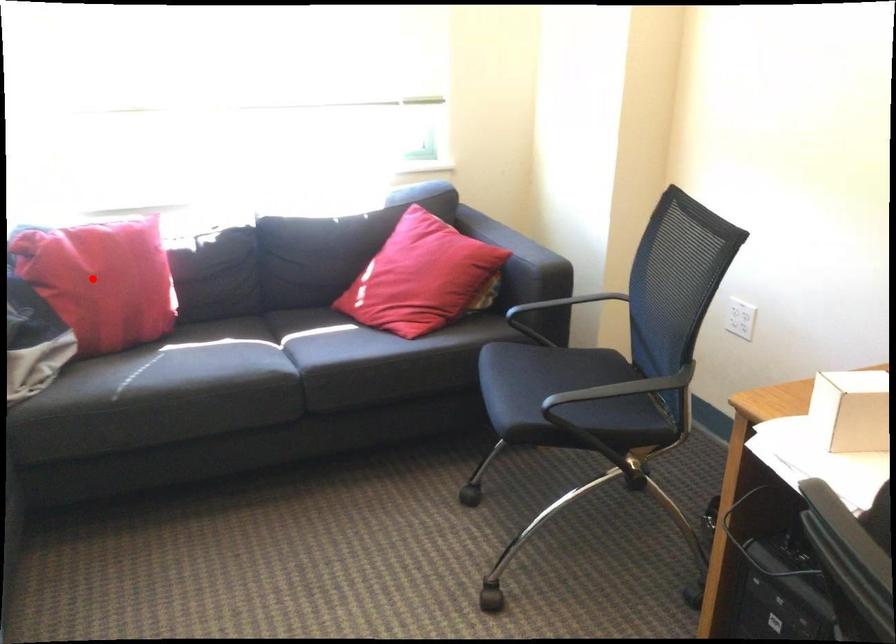
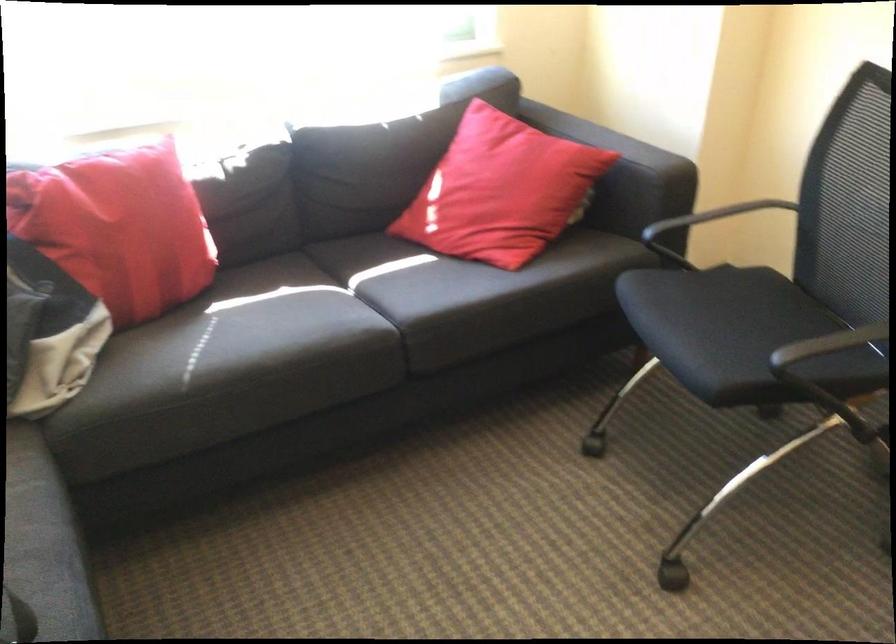
Question: A red point is marked in image1. In image2, is the corresponding 3D point closer to the camera or farther? Reply with the corresponding letter.

Choices:
 (A) The corresponding 3D point is closer.
 (B) The corresponding 3D point is farther.

Answer: (A)